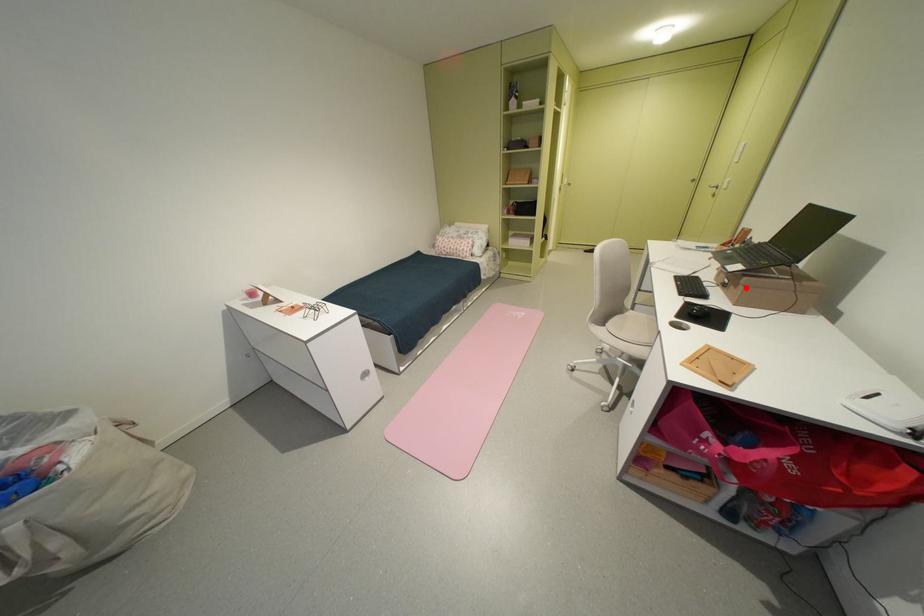
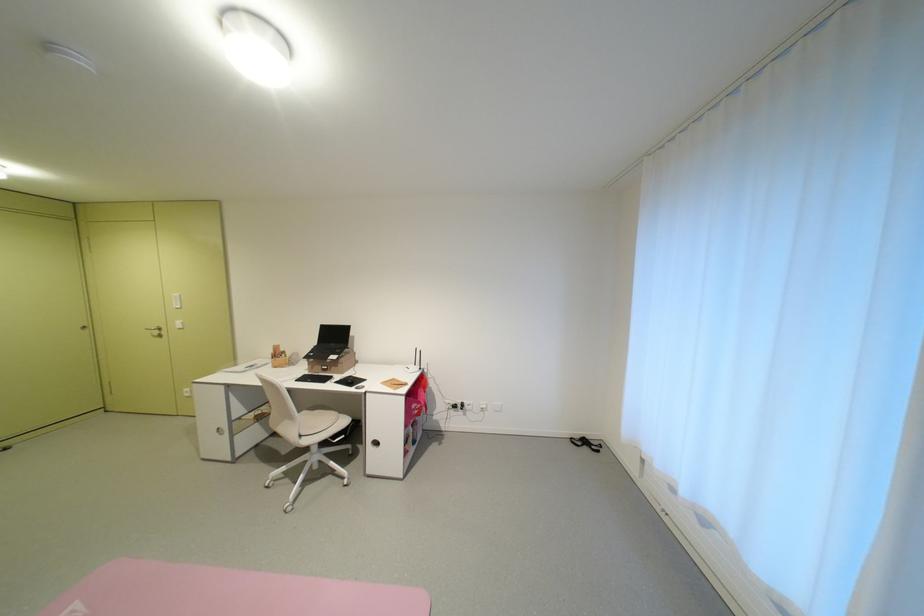
The point at the highlighted location is marked in the first image. Where is the corresponding point in the second image?

(346, 368)